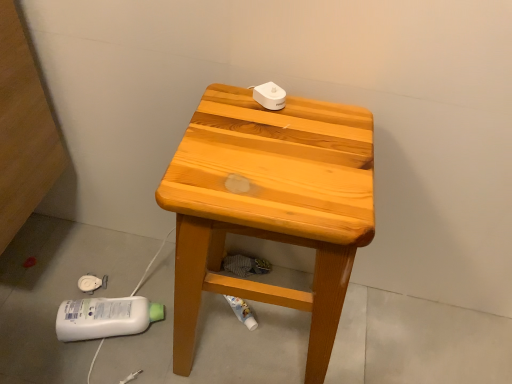
Find the location of a particular element. The height and width of the screenshot is (384, 512). vacant space underneath light brown wooden stool at center (from a real-world perspective) is located at coordinates point(253,338).